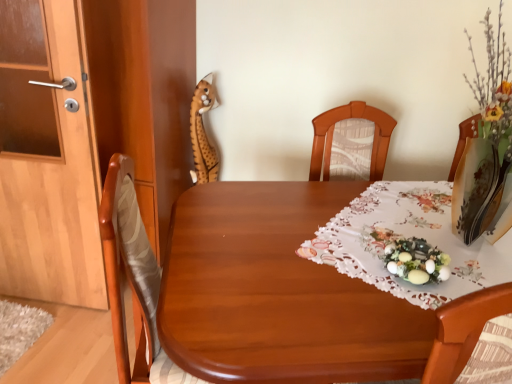
The image size is (512, 384). What are the coordinates of `free location to the left of pastel floral wreath at center` in the screenshot? It's located at coord(352,256).